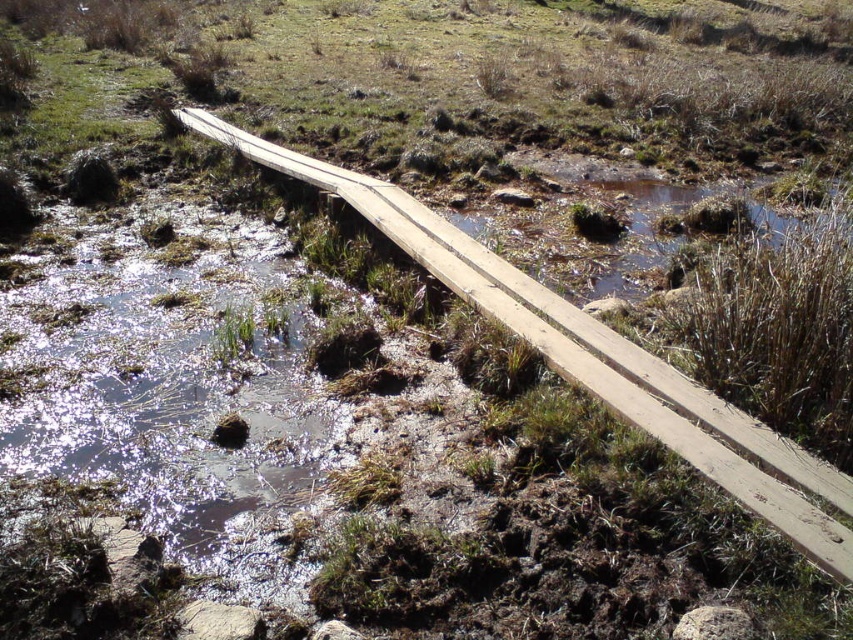
You are a hiker trying to cross the wooden bridge at center. There is a shiny mud water at lower left nearby. If you look to your left while standing on the bridge, what do you see?

The shiny mud water at lower left is to the left of the wooden bridge at center, so when standing on the wooden bridge at center and looking to your left, you will see the shiny mud water at lower left.